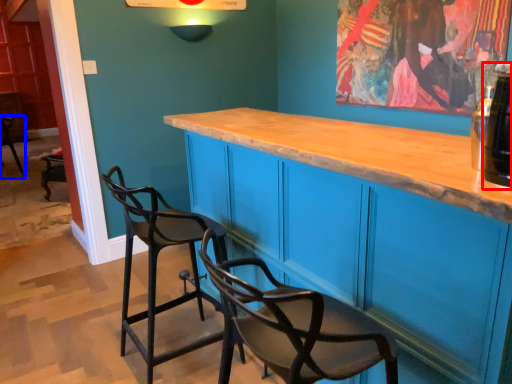
Question: Among these objects, which one is farthest to the camera, beverage (highlighted by a red box) or chair (highlighted by a blue box)?

Choices:
 (A) beverage
 (B) chair

Answer: (B)